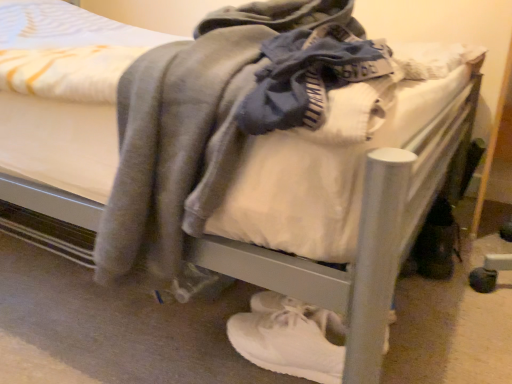
The image size is (512, 384). In order to click on white leather sneakers at lower center in this screenshot , I will do `click(289, 338)`.

The width and height of the screenshot is (512, 384). What do you see at coordinates (289, 338) in the screenshot?
I see `white leather sneakers at lower center` at bounding box center [289, 338].

Image resolution: width=512 pixels, height=384 pixels. In order to click on white leather sneakers at lower center in this screenshot , I will do `click(289, 338)`.